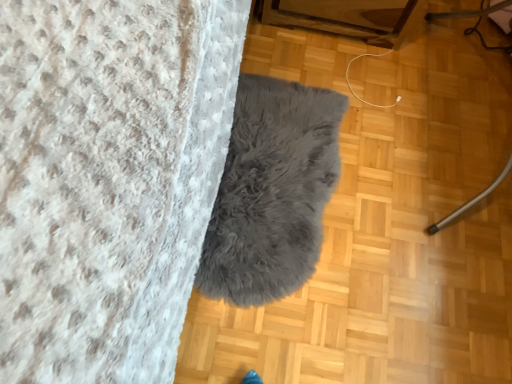
Question: From the image's perspective, relative to metallic silver vacuum cleaner at right, is gray fluffy rug at center above or below?

Choices:
 (A) above
 (B) below

Answer: (B)

Question: From a real-world perspective, relative to metallic silver vacuum cleaner at right, is gray fluffy rug at center vertically above or below?

Choices:
 (A) below
 (B) above

Answer: (A)

Question: Is gray fluffy rug at center to the left or to the right of metallic silver vacuum cleaner at right in the image?

Choices:
 (A) right
 (B) left

Answer: (B)

Question: Considering the positions of metallic silver vacuum cleaner at right and gray fluffy rug at center in the image, is metallic silver vacuum cleaner at right wider or thinner than gray fluffy rug at center?

Choices:
 (A) thin
 (B) wide

Answer: (A)

Question: Relative to gray fluffy rug at center, is metallic silver vacuum cleaner at right in front or behind?

Choices:
 (A) behind
 (B) front

Answer: (B)

Question: From their relative heights in the image, would you say metallic silver vacuum cleaner at right is taller or shorter than gray fluffy rug at center?

Choices:
 (A) tall
 (B) short

Answer: (A)

Question: From a real-world perspective, relative to gray fluffy rug at center, is metallic silver vacuum cleaner at right vertically above or below?

Choices:
 (A) below
 (B) above

Answer: (B)